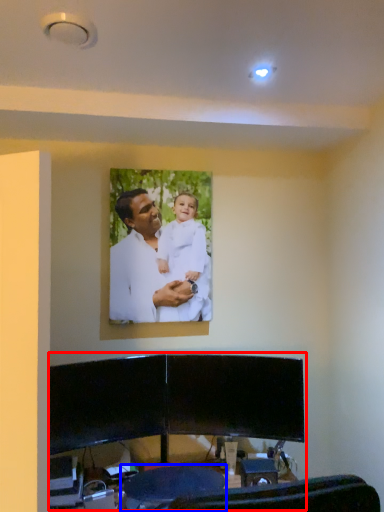
Question: Which object is closer to the camera taking this photo, entertainment center (highlighted by a red box) or swivel chair (highlighted by a blue box)?

Choices:
 (A) entertainment center
 (B) swivel chair

Answer: (A)